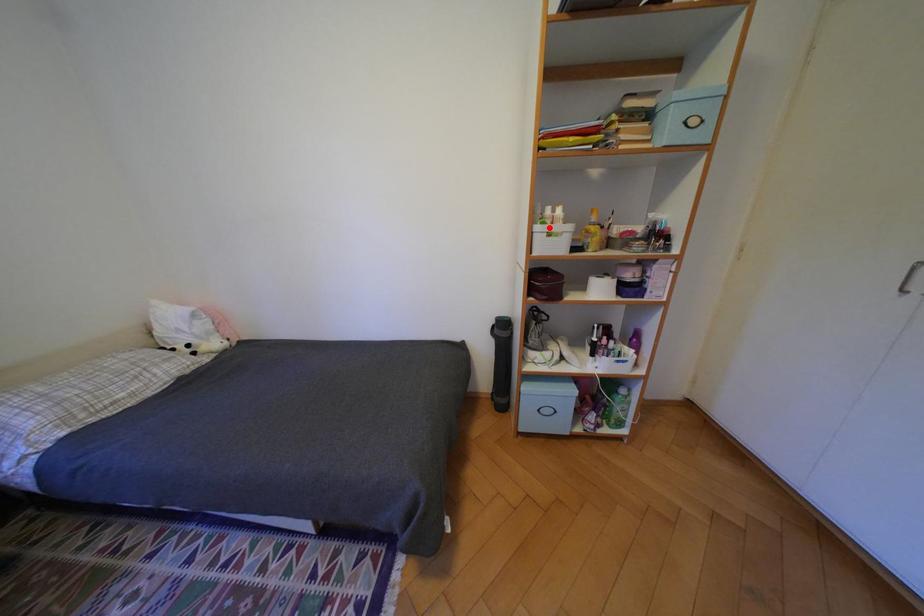
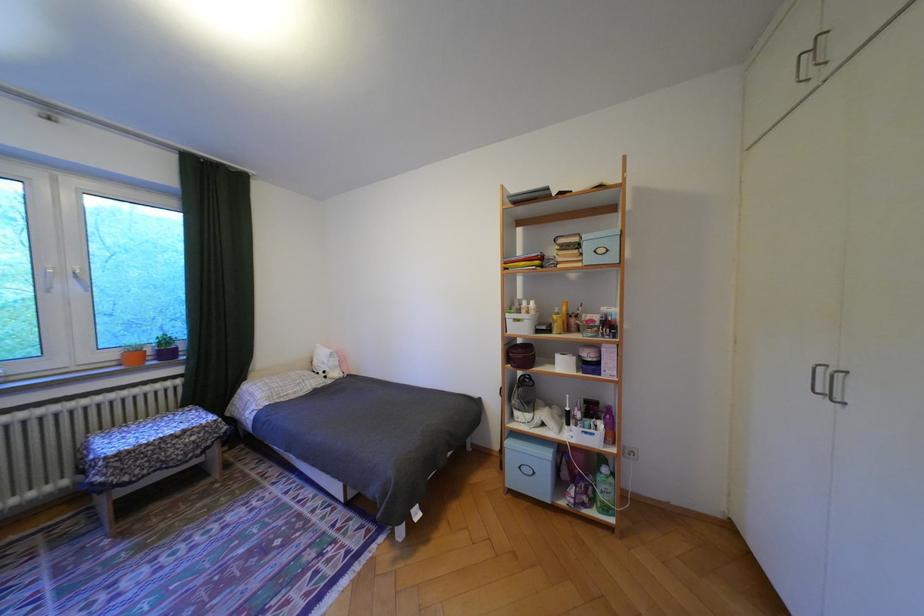
Question: I am providing you with two images of the same scene from different viewpoints. A red point is shown in image1. For the corresponding object point in image2, is it positioned nearer or farther from the camera?

Choices:
 (A) Nearer
 (B) Farther

Answer: (B)